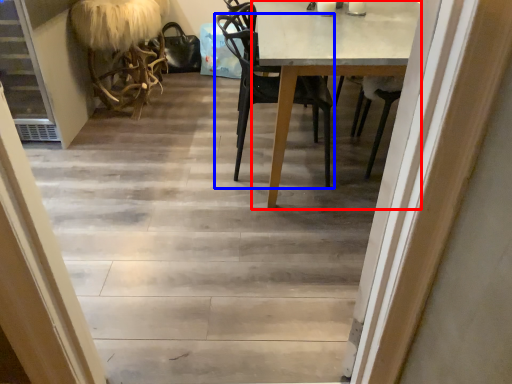
Question: Which point is further to the camera, round table (highlighted by a red box) or chair (highlighted by a blue box)?

Choices:
 (A) round table
 (B) chair

Answer: (B)